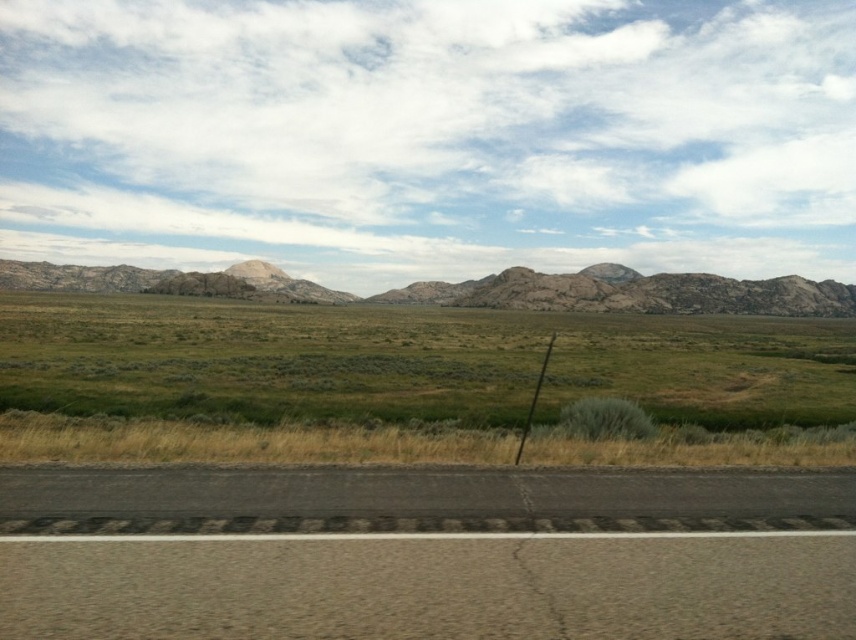
You are driving a car and see the black asphalt road at lower center and the green grassland at center. Which one is narrower?

The black asphalt road at lower center is thinner than the green grassland at center, so the black asphalt road at lower center is narrower.